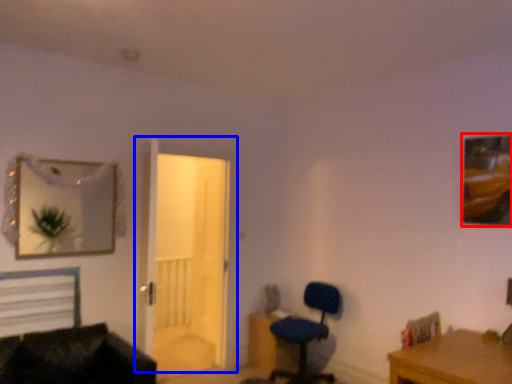
Question: Which object appears farthest to the camera in this image, picture frame (highlighted by a red box) or door (highlighted by a blue box)?

Choices:
 (A) picture frame
 (B) door

Answer: (B)